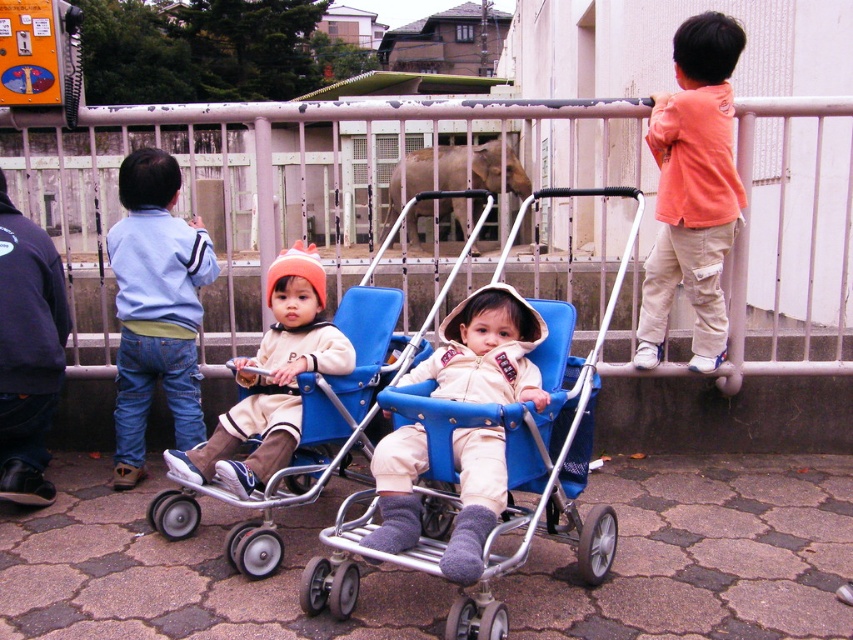
Is point (315, 579) less distant than point (201, 429)?

Yes, point (315, 579) is in front of point (201, 429).

Is blue plastic baby carriage at center taller than blue denim jeans at left?

No.

This screenshot has width=853, height=640. Find the location of `blue plastic baby carriage at center`. blue plastic baby carriage at center is located at coordinates (512, 474).

At what (x,y) coordinates should I click in order to perform the action: click on blue plastic baby carriage at center. Please return your answer as a coordinate pair (x, y). This screenshot has width=853, height=640. Looking at the image, I should click on (512, 474).

Does blue denim jeans at left have a larger size compared to matte beige jacket at center?

Incorrect, blue denim jeans at left is not larger than matte beige jacket at center.

Can you confirm if blue denim jeans at left is positioned to the right of matte beige jacket at center?

Incorrect, blue denim jeans at left is not on the right side of matte beige jacket at center.

Does point (117, 403) come behind point (252, 358)?

Yes, it is behind point (252, 358).

In order to click on blue denim jeans at left in this screenshot , I will do `click(155, 307)`.

Between blue plastic baby carriage at center and beige soft fabric baby stroller at center, which one appears on the left side from the viewer's perspective?

From the viewer's perspective, beige soft fabric baby stroller at center appears more on the left side.

Can you confirm if blue plastic baby carriage at center is wider than beige soft fabric baby stroller at center?

Yes.

Which is behind, point (608, 522) or point (463, 486)?

Point (608, 522)

You are a GUI agent. You are given a task and a screenshot of the screen. Output one action in this format:
    pyautogui.click(x=<x>, y=<y>)
    Task: Click on the blue plastic baby carriage at center
    The height and width of the screenshot is (640, 853).
    Given the screenshot: What is the action you would take?
    pyautogui.click(x=512, y=474)